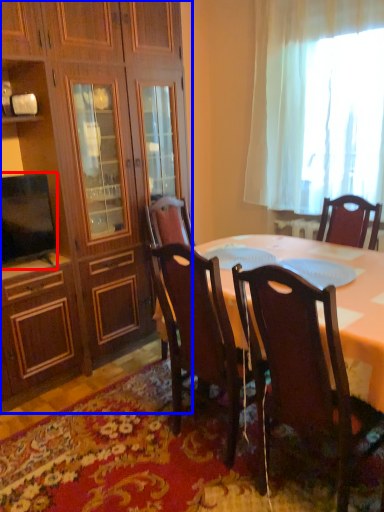
Question: Which object appears closest to the camera in this image, television (highlighted by a red box) or cabinetry (highlighted by a blue box)?

Choices:
 (A) television
 (B) cabinetry

Answer: (B)